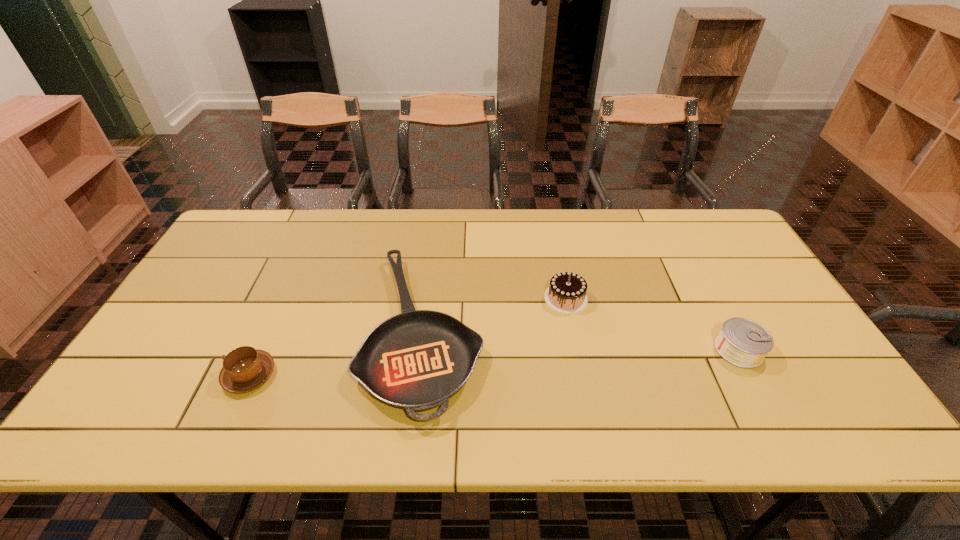
You are a GUI agent. You are given a task and a screenshot of the screen. Output one action in this format:
    pyautogui.click(x=<x>, y=<y>)
    Task: Click on the vacant position located on the left of the rightmost object
    The image size is (960, 540).
    Given the screenshot: What is the action you would take?
    pyautogui.click(x=664, y=350)

Locate an element on the screen. Image resolution: width=960 pixels, height=540 pixels. free space located 0.290m on the right of the third object from right to left is located at coordinates (593, 330).

Identify the location of object positioned at the near edge. Image resolution: width=960 pixels, height=540 pixels. (417, 360).

Image resolution: width=960 pixels, height=540 pixels. Identify the location of object located in the right edge section of the desktop. (742, 342).

In the image, there is a desktop. Where is `vacant space at the far edge`? vacant space at the far edge is located at coordinates (557, 233).

At what (x,y) coordinates should I click in order to perform the action: click on free space at the near edge of the desktop. Please return your answer as a coordinate pair (x, y). Image resolution: width=960 pixels, height=540 pixels. Looking at the image, I should click on (655, 402).

Locate an element on the screen. The image size is (960, 540). vacant space at the left edge of the desktop is located at coordinates (171, 327).

In the image, there is a desktop. Identify the location of vacant space at the right edge. (722, 265).

Locate an element on the screen. free space at the far right corner of the desktop is located at coordinates (726, 246).

The image size is (960, 540). I want to click on vacant area that lies between the rightmost object and the shortest object, so click(x=581, y=340).